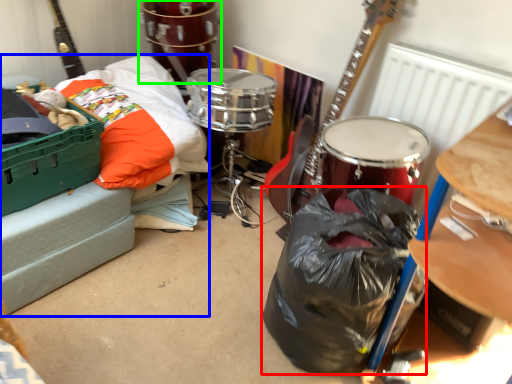
Question: Based on their relative distances, which object is farther from garbage (highlighted by a red box)? Choose from couch (highlighted by a blue box) and drum (highlighted by a green box).

Choices:
 (A) couch
 (B) drum

Answer: (B)